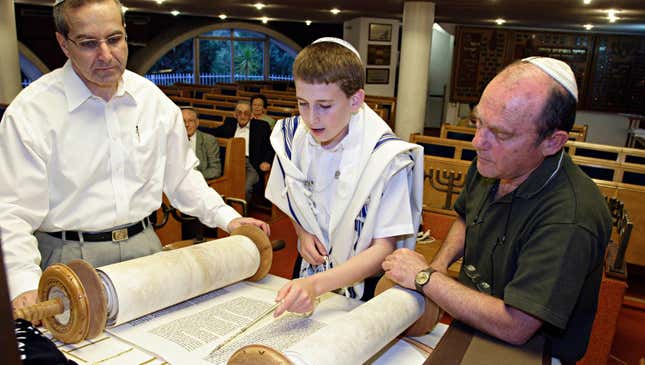
You are a GUI agent. You are given a task and a screenshot of the screen. Output one action in this format:
    pyautogui.click(x=<x>, y=<y>)
    Task: Click on the pews
    The width and height of the screenshot is (645, 365).
    Given the screenshot: What is the action you would take?
    pyautogui.click(x=444, y=139), pyautogui.click(x=453, y=132), pyautogui.click(x=213, y=113), pyautogui.click(x=217, y=100), pyautogui.click(x=224, y=95), pyautogui.click(x=255, y=95), pyautogui.click(x=277, y=88)